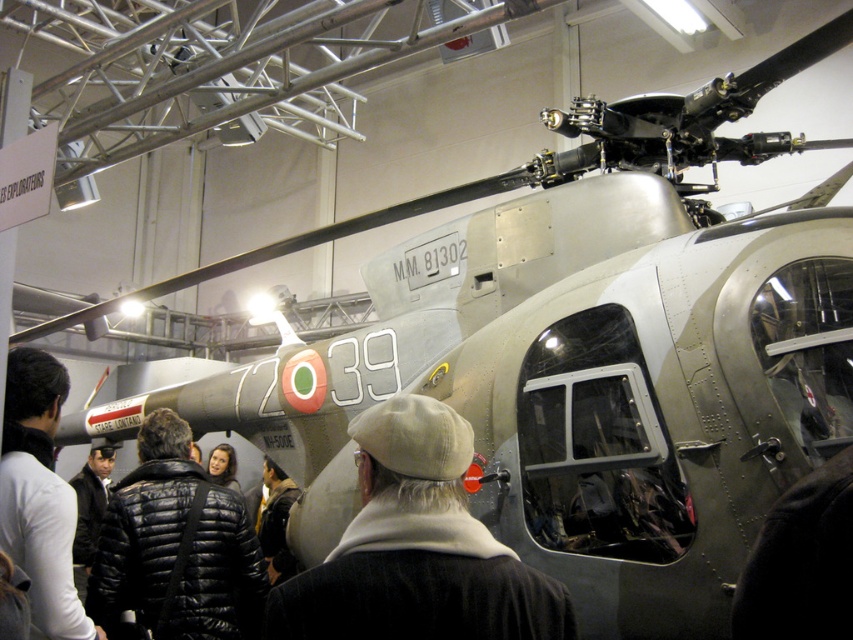
Who is lower down, beige woolen hat at center or leather jacket at center?

leather jacket at center is lower down.

Does point (485, 547) come in front of point (265, 554)?

Yes, it is in front of point (265, 554).

Locate an element on the screen. beige woolen hat at center is located at coordinates (416, 547).

Does leather jacket at center have a larger size compared to black jacket at center?

Yes.

Between point (270, 481) and point (222, 456), which one is positioned in front?

Point (270, 481)

Between point (264, 522) and point (219, 476), which one is positioned in front?

Point (264, 522)

Where is `leather jacket at center`? leather jacket at center is located at coordinates (276, 522).

Does black puffer jacket at center have a lesser width compared to black quilted jacket at lower left?

No.

Looking at this image, does black puffer jacket at center appear on the right side of black quilted jacket at lower left?

Yes, black puffer jacket at center is to the right of black quilted jacket at lower left.

This screenshot has height=640, width=853. Describe the element at coordinates (177, 547) in the screenshot. I see `black puffer jacket at center` at that location.

The width and height of the screenshot is (853, 640). Find the location of `black puffer jacket at center`. black puffer jacket at center is located at coordinates (177, 547).